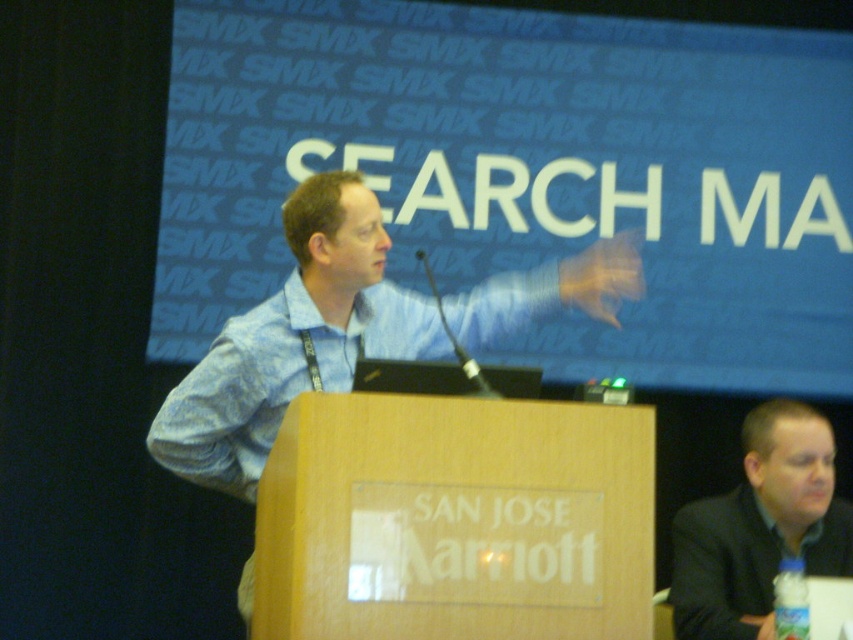
Question: Observing the image, what is the correct spatial positioning of blue shirt at center in reference to dark gray suit at lower right?

Choices:
 (A) left
 (B) right

Answer: (A)

Question: Which point appears farthest from the camera in this image?

Choices:
 (A) (811, 420)
 (B) (357, 180)

Answer: (A)

Question: Is blue shirt at center above dark gray suit at lower right?

Choices:
 (A) no
 (B) yes

Answer: (B)

Question: Does blue shirt at center appear on the left side of dark gray suit at lower right?

Choices:
 (A) no
 (B) yes

Answer: (B)

Question: Which of the following is the farthest from the observer?

Choices:
 (A) blue shirt at center
 (B) dark gray suit at lower right

Answer: (A)